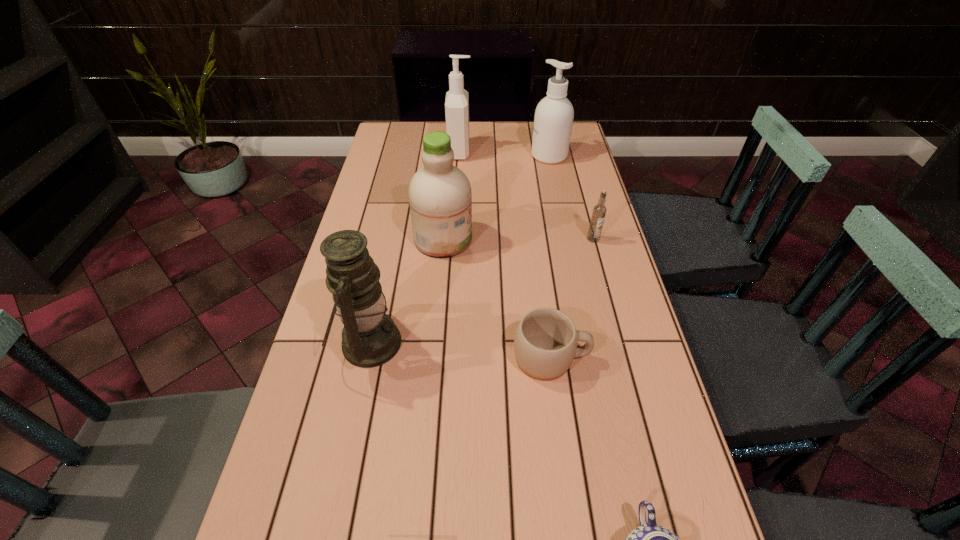
Locate an element on the screen. Image resolution: width=960 pixels, height=540 pixels. free point located 0.180m on the label of the fifth tallest object is located at coordinates (607, 288).

Identify the location of object that is at the left edge. This screenshot has height=540, width=960. (370, 338).

Find the location of a particular element. cleansing agent present at the right edge is located at coordinates (554, 114).

At what (x,y) coordinates should I click in order to perform the action: click on vodka that is at the right edge. Please return your answer as a coordinate pair (x, y). Image resolution: width=960 pixels, height=540 pixels. Looking at the image, I should click on (599, 211).

This screenshot has width=960, height=540. In order to click on mug at the right edge in this screenshot , I will do `click(545, 343)`.

Identify the location of object situated at the far right corner. Image resolution: width=960 pixels, height=540 pixels. (554, 114).

The image size is (960, 540). Find the location of `free space at the far edge`. free space at the far edge is located at coordinates (519, 140).

Locate an element on the screen. vacant space at the left edge is located at coordinates (384, 173).

The image size is (960, 540). Find the location of `free region at the right edge`. free region at the right edge is located at coordinates (582, 300).

The width and height of the screenshot is (960, 540). In the image, there is a desktop. Identify the location of vacant region at the far left corner. (387, 140).